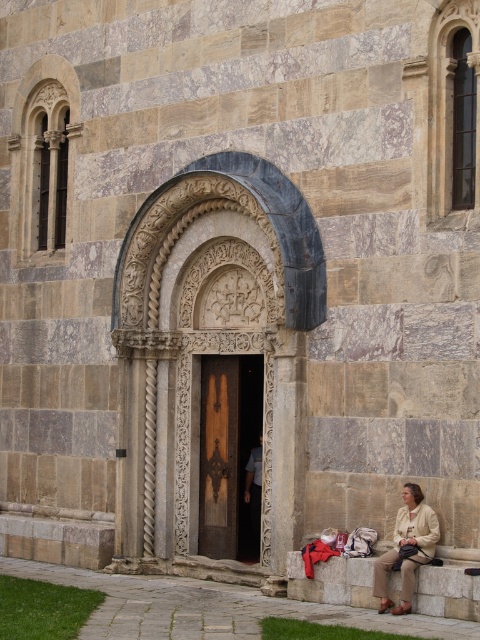
You are a visitor standing in front of the historic stone building. You notice a beige fabric jacket at lower right and a dark brown wood door at center. Which object occupies more space in the image?

The beige fabric jacket at lower right occupies more space in the image because it is bigger than the dark brown wood door at center.